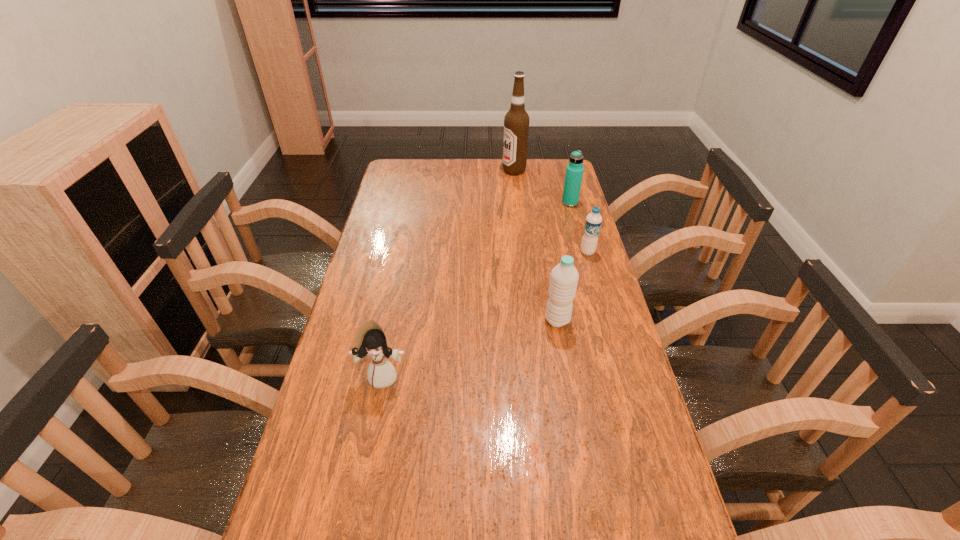
In order to click on the farthest object in this screenshot , I will do `click(516, 122)`.

Where is `the tallest object`? The image size is (960, 540). the tallest object is located at coordinates (516, 122).

Identify the location of the leftmost water bottle. (564, 278).

Where is `the fourth farthest object`? The image size is (960, 540). the fourth farthest object is located at coordinates (564, 278).

You are a GUI agent. You are given a task and a screenshot of the screen. Output one action in this format:
    pyautogui.click(x=<x>, y=<y>)
    Task: Click on the farthest water bottle
    The image size is (960, 540).
    Given the screenshot: What is the action you would take?
    pyautogui.click(x=574, y=172)

Image resolution: width=960 pixels, height=540 pixels. Find the location of `the nearest object`. the nearest object is located at coordinates (371, 340).

Locate an element on the screen. doll is located at coordinates (371, 340).

Where is `the shortest water bottle`? The image size is (960, 540). the shortest water bottle is located at coordinates (593, 222).

Find the location of a particular element. The height and width of the screenshot is (540, 960). the second farthest water bottle is located at coordinates [x=593, y=222].

At what (x,y) coordinates should I click in order to perform the action: click on free space located on the label of the alcohol. Please return your answer as a coordinate pair (x, y). The width and height of the screenshot is (960, 540). Looking at the image, I should click on (435, 171).